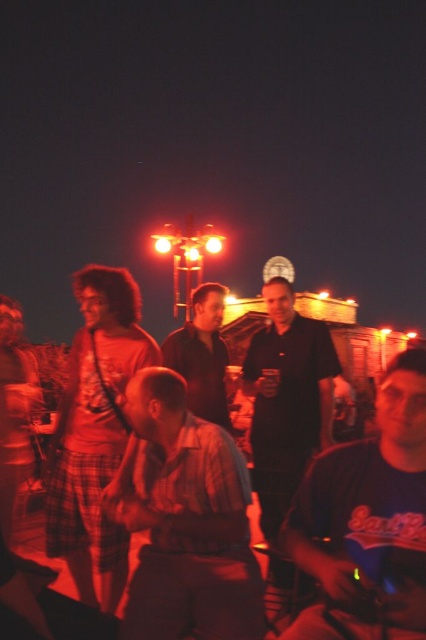
Question: Which object is positioned closest to the matte black shirt at center?

Choices:
 (A) dark blue t-shirt at lower right
 (B) dark brown leather jacket at center

Answer: (B)

Question: Is striped cotton shirt at center smaller than matte black shirt at center?

Choices:
 (A) yes
 (B) no

Answer: (A)

Question: Is striped cotton shirt at center bigger than dark brown leather jacket at center?

Choices:
 (A) no
 (B) yes

Answer: (B)

Question: Is matte black shirt at center positioned in front of dark brown leather jacket at center?

Choices:
 (A) yes
 (B) no

Answer: (A)

Question: Which point appears farthest from the camera in this image?

Choices:
 (A) (293, 493)
 (B) (106, 310)
 (C) (166, 538)

Answer: (B)

Question: Among these points, which one is farthest from the camera?

Choices:
 (A) (210, 378)
 (B) (273, 502)
 (C) (353, 444)
 (D) (152, 627)

Answer: (A)